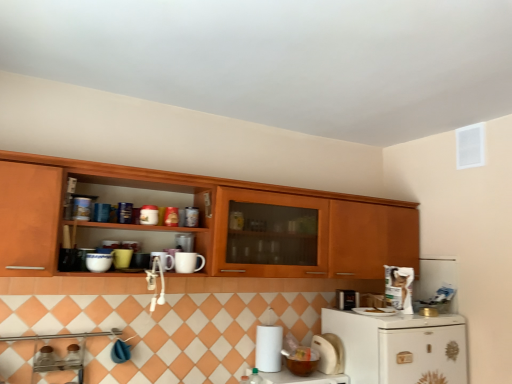
Question: From the image's perspective, would you say white glossy refrigerator at lower right is shown under white matte paper towel at lower center?

Choices:
 (A) no
 (B) yes

Answer: (B)

Question: Does white glossy refrigerator at lower right turn towards white matte paper towel at lower center?

Choices:
 (A) yes
 (B) no

Answer: (B)

Question: From a real-world perspective, is white glossy refrigerator at lower right physically above white matte paper towel at lower center?

Choices:
 (A) no
 (B) yes

Answer: (A)

Question: Does white glossy refrigerator at lower right have a smaller size compared to white matte paper towel at lower center?

Choices:
 (A) no
 (B) yes

Answer: (A)

Question: Is white glossy refrigerator at lower right shorter than white matte paper towel at lower center?

Choices:
 (A) yes
 (B) no

Answer: (B)

Question: In the image, is white glossy refrigerator at lower right positioned in front of or behind white glossy bowl at lower center?

Choices:
 (A) front
 (B) behind

Answer: (A)

Question: Considering the positions of white glossy refrigerator at lower right and white glossy bowl at lower center in the image, is white glossy refrigerator at lower right wider or thinner than white glossy bowl at lower center?

Choices:
 (A) wide
 (B) thin

Answer: (A)

Question: From the image's perspective, is white glossy refrigerator at lower right positioned above or below white glossy bowl at lower center?

Choices:
 (A) below
 (B) above

Answer: (B)

Question: Considering the positions of point (456, 370) and point (329, 377), is point (456, 370) closer or farther from the camera than point (329, 377)?

Choices:
 (A) closer
 (B) farther

Answer: (B)

Question: Relative to white matte paper towel holder at lower right, acting as the 3th appliance starting from the right, is white glossy refrigerator at lower right in front or behind?

Choices:
 (A) front
 (B) behind

Answer: (A)

Question: Does point (355, 332) appear closer or farther from the camera than point (330, 344)?

Choices:
 (A) closer
 (B) farther

Answer: (A)

Question: Is white glossy refrigerator at lower right inside the boundaries of white matte paper towel holder at lower right, acting as the 3th appliance starting from the right, or outside?

Choices:
 (A) outside
 (B) inside

Answer: (A)

Question: From the image's perspective, is white glossy refrigerator at lower right positioned above or below white matte paper towel holder at lower right, acting as the 3th appliance starting from the right?

Choices:
 (A) below
 (B) above

Answer: (A)

Question: Considering their positions, is white matte paper towel at lower center located in front of or behind matte ceramic mug at upper center, positioned as the ninth appliance in right-to-left order?

Choices:
 (A) behind
 (B) front

Answer: (A)

Question: Is white matte paper towel at lower center wider or thinner than matte ceramic mug at upper center, acting as the 2th appliance starting from the left?

Choices:
 (A) wide
 (B) thin

Answer: (A)